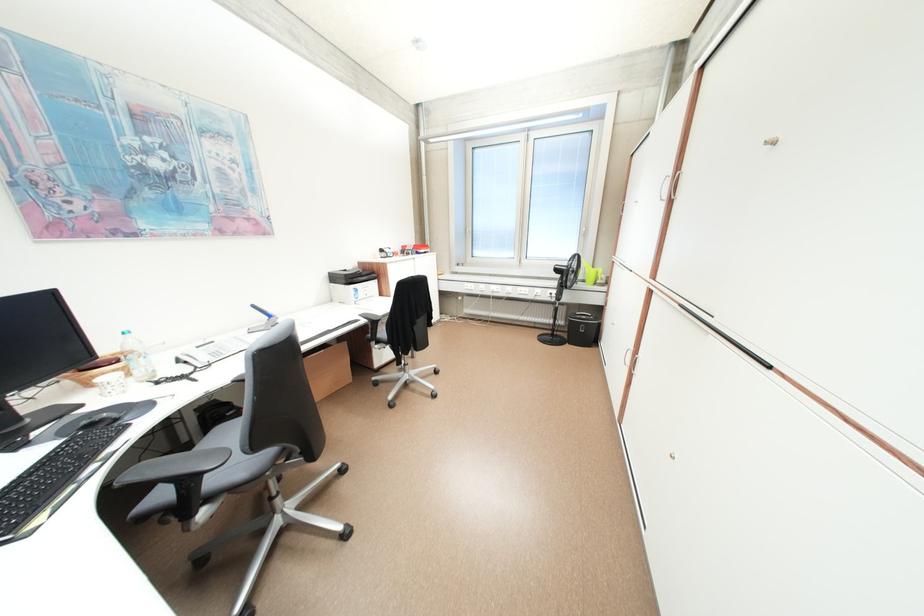
This screenshot has width=924, height=616. Describe the element at coordinates (602, 357) in the screenshot. I see `the printer lid` at that location.